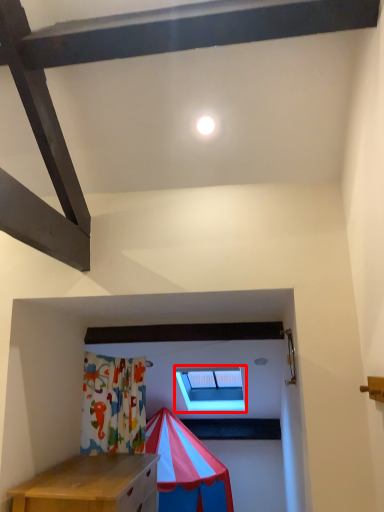
Question: In this image, where is window (annotated by the red box) located relative to light?

Choices:
 (A) left
 (B) right

Answer: (B)